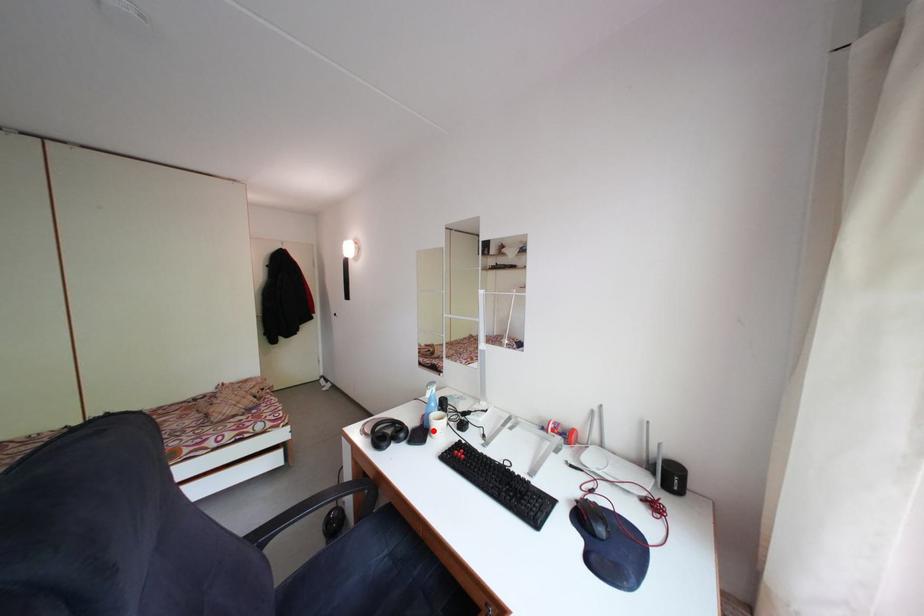
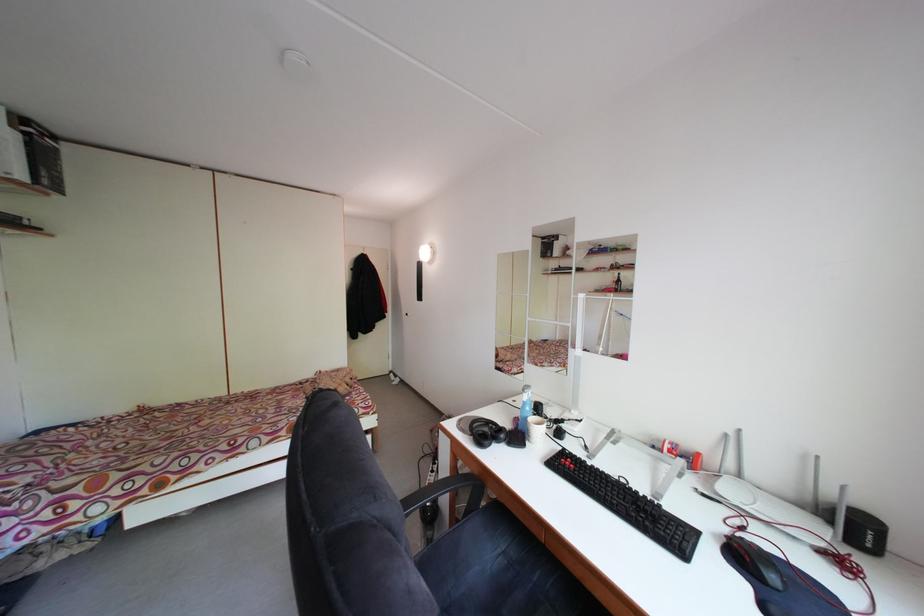
The point at the highlighted location is marked in the first image. Where is the corresponding point in the second image?

(528, 434)